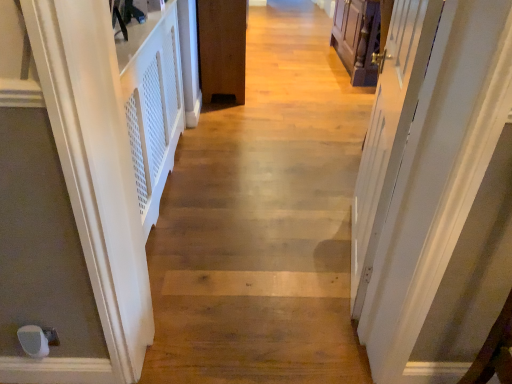
Locate an element on the screen. Image resolution: width=512 pixels, height=384 pixels. free region on the left part of white glossy door at right is located at coordinates (271, 246).